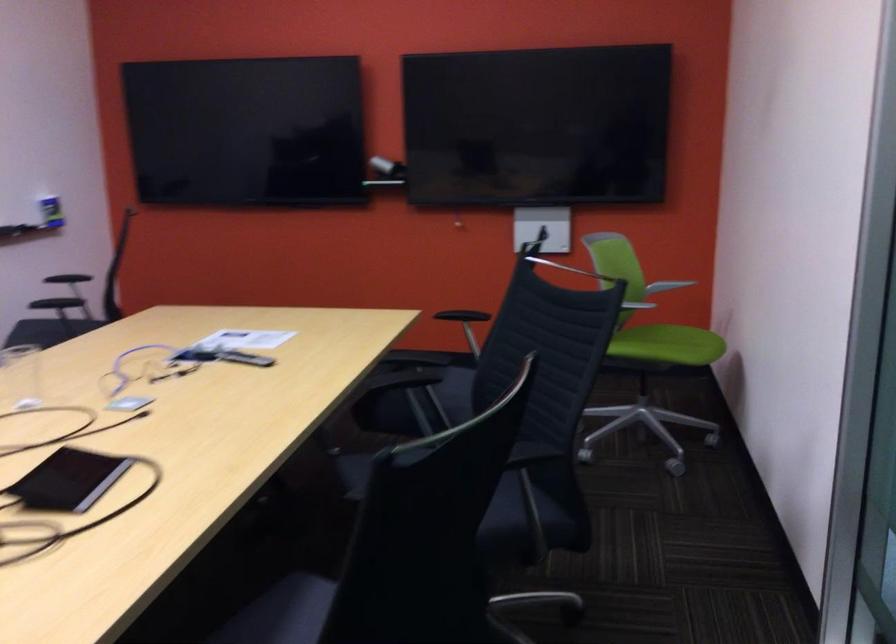
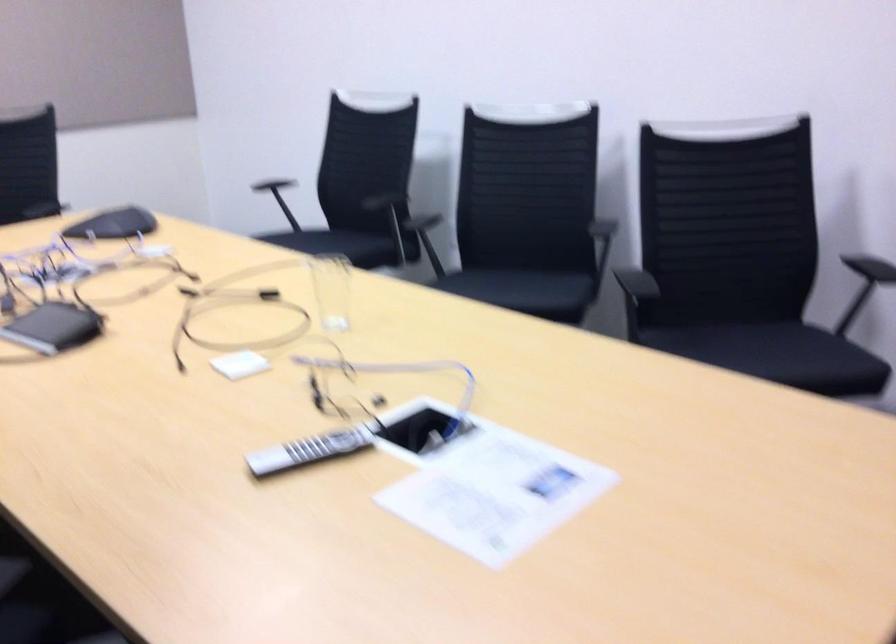
The point at (255, 355) is marked in the first image. Where is the corresponding point in the second image?

(308, 450)